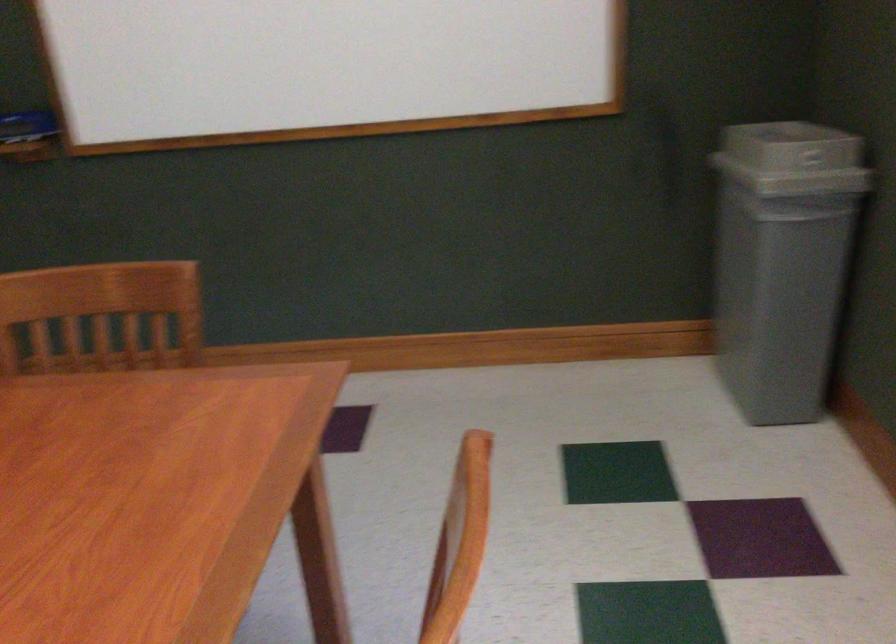
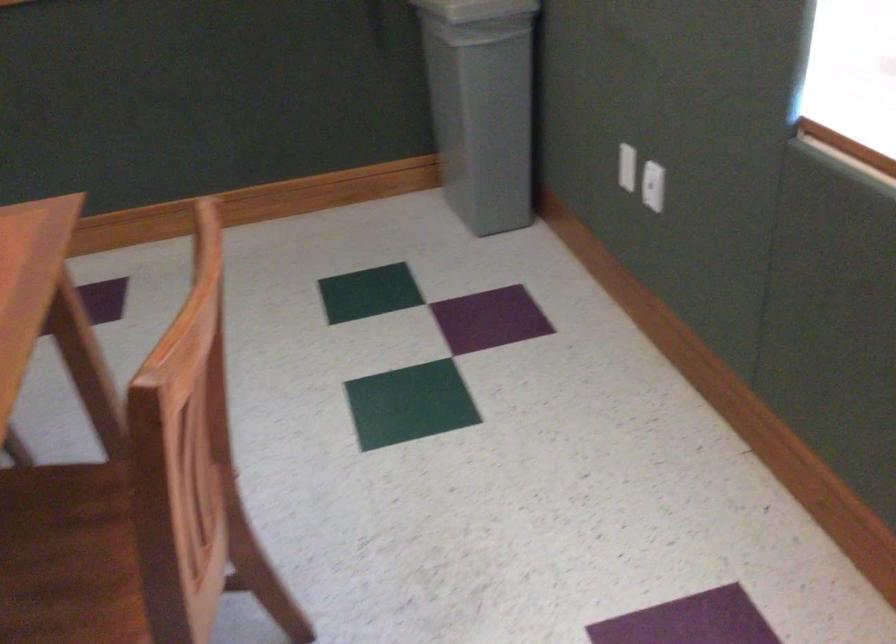
Question: The camera is either moving clockwise (left) or counter-clockwise (right) around the object. The first image is from the beginning of the video and the second image is from the end. Is the camera moving left or right when shooting the video?

Choices:
 (A) Left
 (B) Right

Answer: (A)